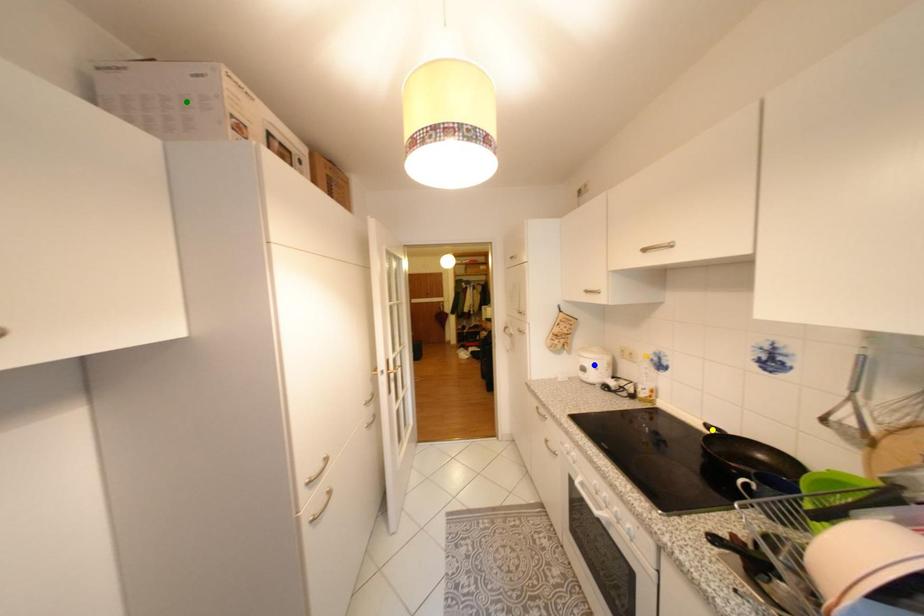
Order these from nearest to farthest:
yellow point
blue point
green point

Result: green point → yellow point → blue point